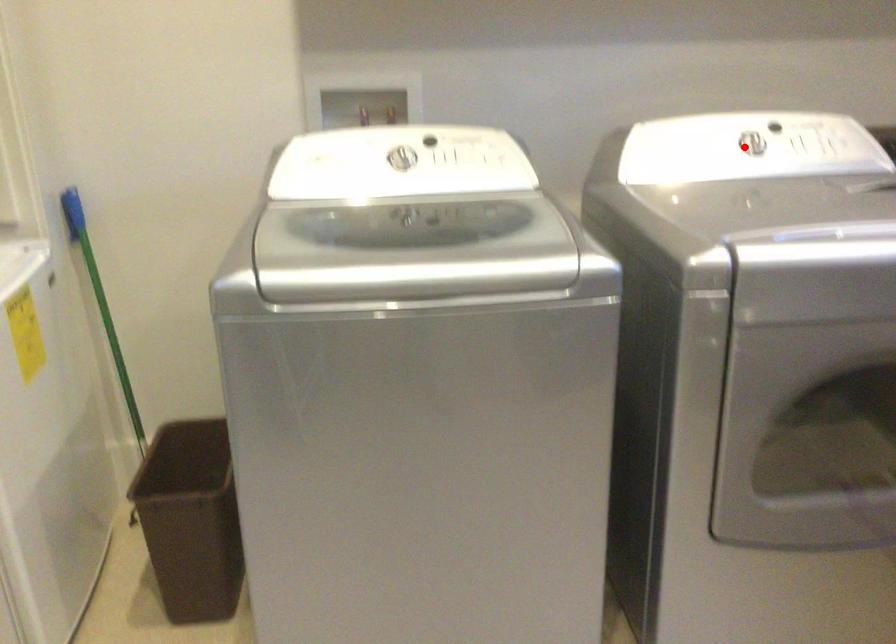
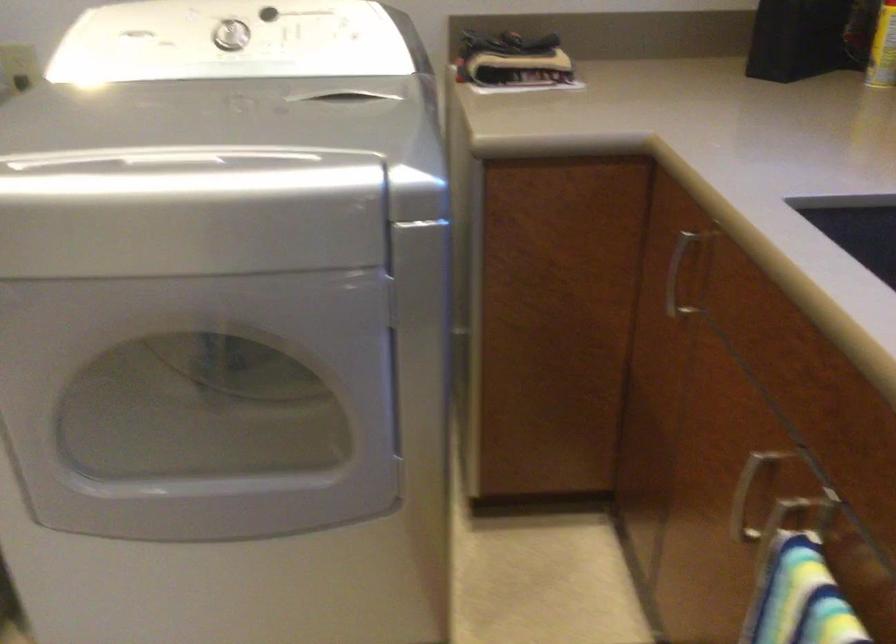
Find the pixel in the second image that matches the highlighted location in the first image.

(229, 35)